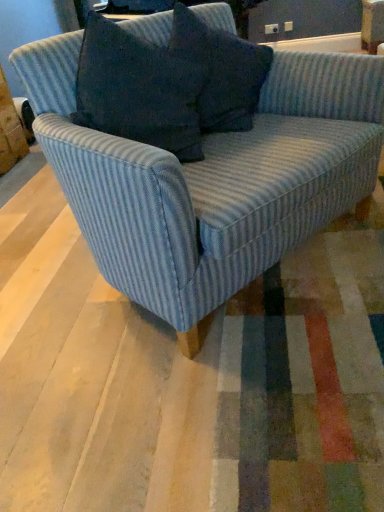
The width and height of the screenshot is (384, 512). I want to click on vacant area that lies in front of blue striped fabric couch at center, so click(x=224, y=391).